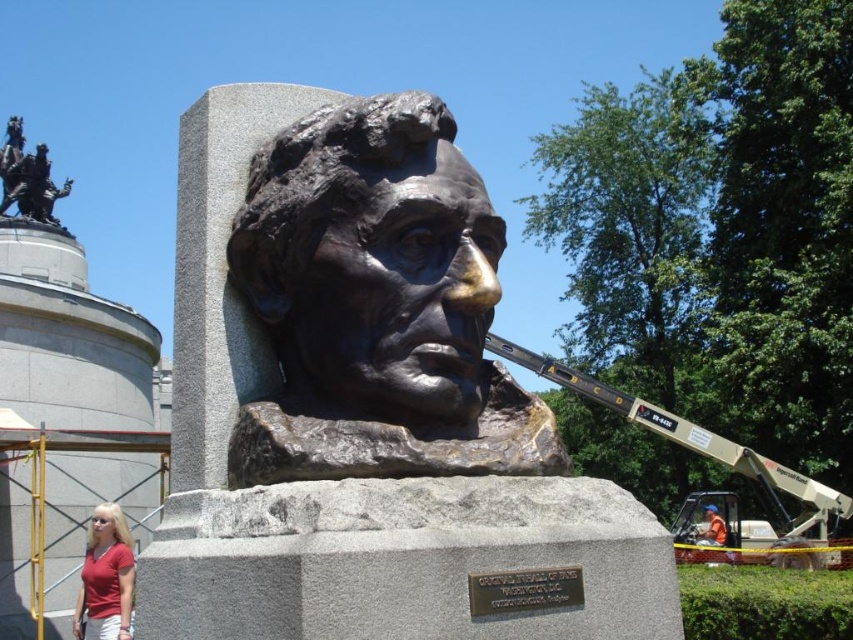
Is bronze statue at upper left above orange fabric at lower right?

Yes.

Is point (0, 163) more distant than point (718, 532)?

Yes, it is.

Find the location of a particular element. bronze statue at upper left is located at coordinates (27, 177).

From the picture: Is matte red shirt at lower left to the left of bronze statue at upper left from the viewer's perspective?

In fact, matte red shirt at lower left is to the right of bronze statue at upper left.

Is point (109, 518) positioned in front of point (4, 177)?

Yes, point (109, 518) is closer to viewer.

The image size is (853, 640). I want to click on matte red shirt at lower left, so click(x=105, y=577).

Does bronze sculpture at center have a lesser height compared to bronze bust at center?

No.

Can you confirm if bronze sculpture at center is positioned above bronze bust at center?

No.

Between point (631, 602) and point (418, 182), which one is positioned in front?

Positioned in front is point (631, 602).

You are a GUI agent. You are given a task and a screenshot of the screen. Output one action in this format:
    pyautogui.click(x=<x>, y=<y>)
    Task: Click on the bronze sculpture at center
    This screenshot has height=640, width=853.
    Given the screenshot: What is the action you would take?
    [366, 403]